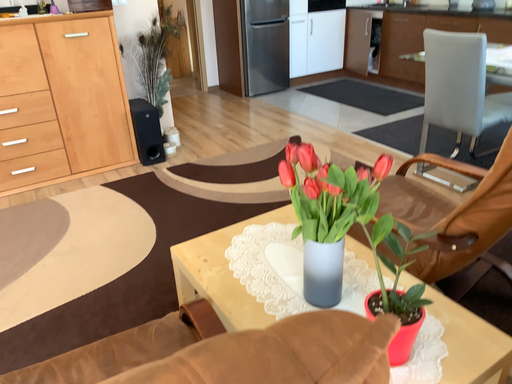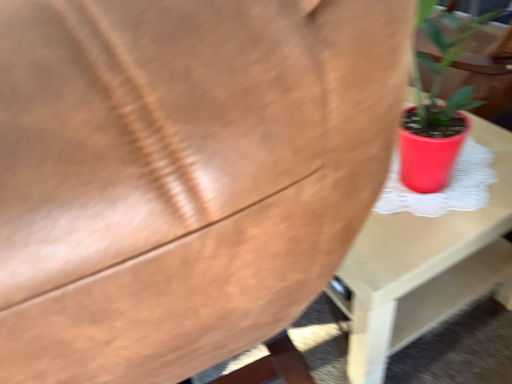
Question: Which way did the camera rotate in the video?

Choices:
 (A) rotated downward
 (B) rotated upward

Answer: (A)